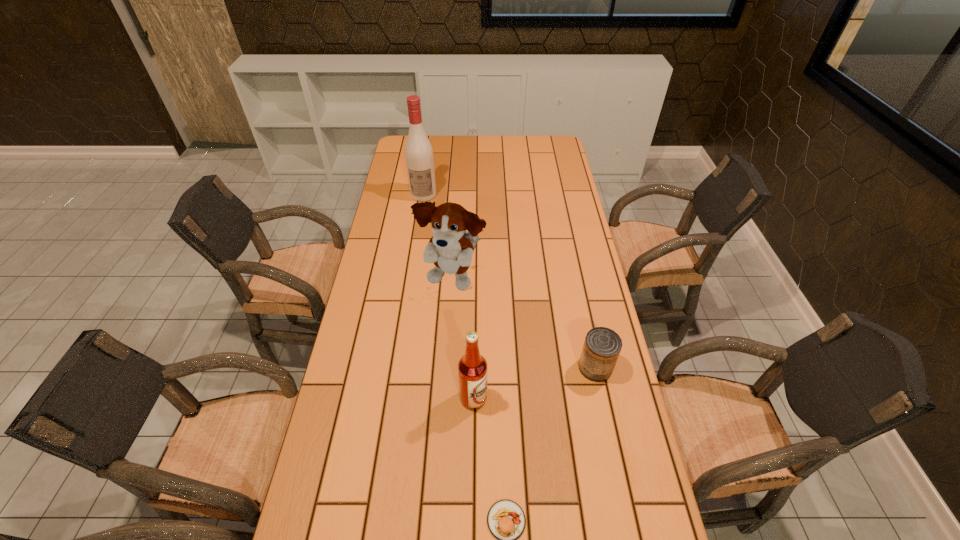
The height and width of the screenshot is (540, 960). I want to click on the farther alcohol, so click(419, 157).

Where is `the left alcohol`? the left alcohol is located at coordinates (419, 157).

Locate an element on the screen. the fourth nearest object is located at coordinates point(451,248).

In order to click on the right alcohol in this screenshot , I will do `click(472, 367)`.

Where is `the shorter alcohol`? Image resolution: width=960 pixels, height=540 pixels. the shorter alcohol is located at coordinates (472, 367).

Where is `the rightmost object`? This screenshot has height=540, width=960. the rightmost object is located at coordinates (602, 346).

The height and width of the screenshot is (540, 960). I want to click on the third farthest object, so click(x=602, y=346).

The image size is (960, 540). In order to click on free space located 0.060m on the label of the farther alcohol in this screenshot , I will do `click(420, 211)`.

Find the location of a particular element. The width and height of the screenshot is (960, 540). vacant area situated 0.370m on the face of the fourth nearest object is located at coordinates (444, 409).

You are a GUI agent. You are given a task and a screenshot of the screen. Output one action in this format:
    pyautogui.click(x=<x>, y=<y>)
    Task: Click on the vacant space located on the label side of the nearer alcohol
    The height and width of the screenshot is (540, 960).
    Given the screenshot: What is the action you would take?
    pyautogui.click(x=605, y=398)